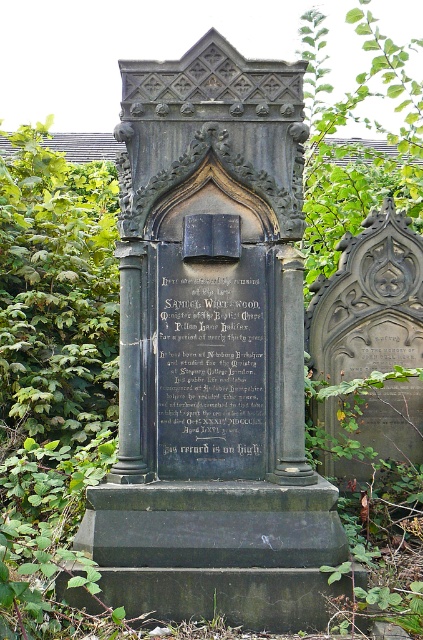
Is dark gray stone monument at center smaller than black stone plaque at center?

No, dark gray stone monument at center is not smaller than black stone plaque at center.

Between point (132, 545) and point (252, 305), which one is positioned in front?

Positioned in front is point (132, 545).

The image size is (423, 640). I want to click on dark gray stone monument at center, so click(213, 353).